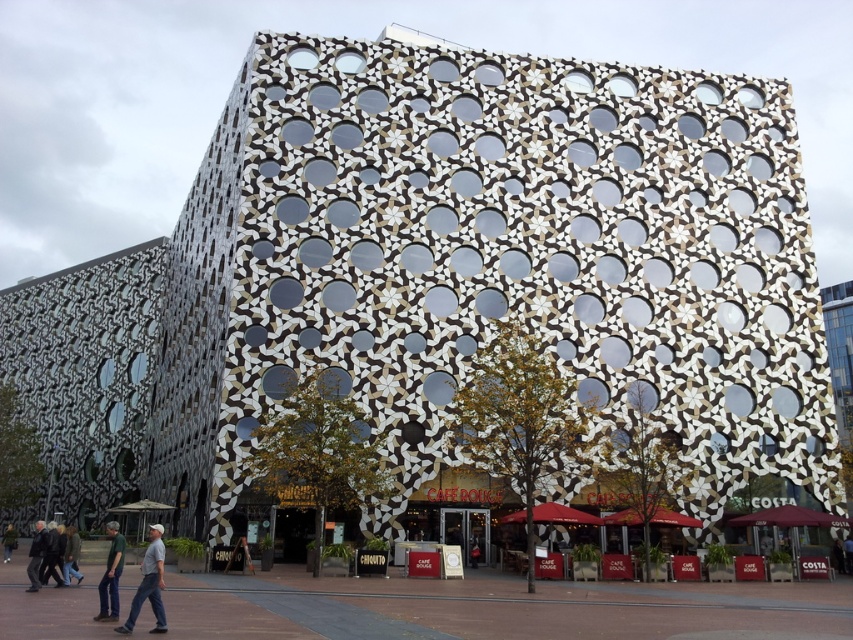
You are standing in front of the modern building and notice two items at the lower left of the image. Which item is nearer to you between the gray fabric pants at lower left and the dark gray jacket at lower left?

The gray fabric pants at lower left is closer to the viewer than the dark gray jacket at lower left.

You are standing in front of the modern building and notice two people wearing gray fabric pants at lower left and dark green shirt at lower left. Which of these two items of clothing is positioned closer to you?

The gray fabric pants at lower left are closer to the viewer than the dark green shirt at lower left.